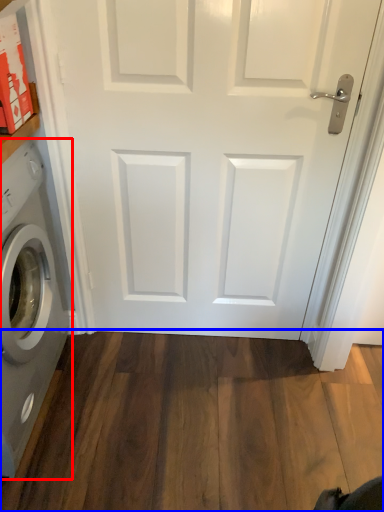
Question: Among these objects, which one is nearest to the camera, washing machine (highlighted by a red box) or hardwood (highlighted by a blue box)?

Choices:
 (A) washing machine
 (B) hardwood

Answer: (A)